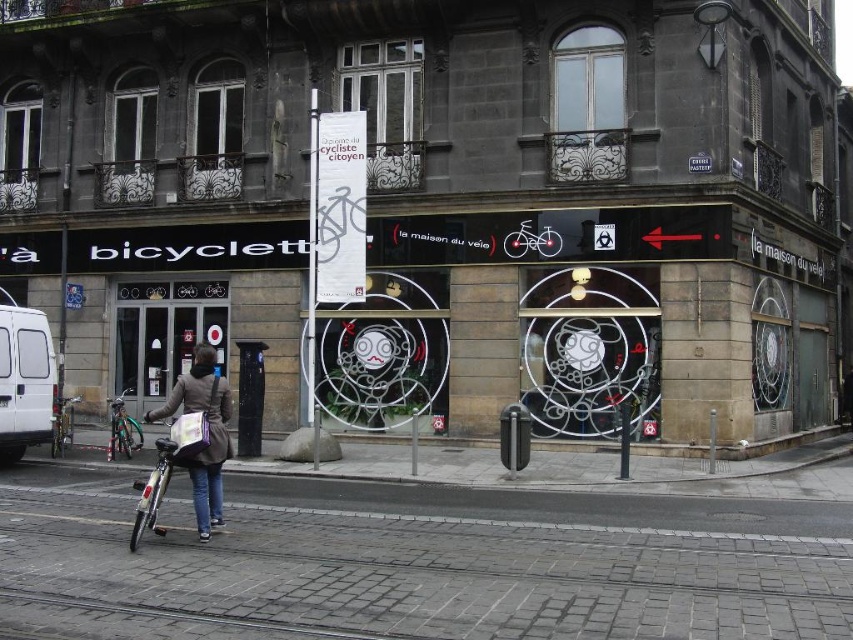
Is matte brown jacket at center bigger than silver metallic bicycle at lower left?

Correct, matte brown jacket at center is larger in size than silver metallic bicycle at lower left.

Is matte brown jacket at center closer to the viewer compared to silver metallic bicycle at lower left?

Yes.

You are a GUI agent. You are given a task and a screenshot of the screen. Output one action in this format:
    pyautogui.click(x=<x>, y=<y>)
    Task: Click on the matte brown jacket at center
    This screenshot has width=853, height=640.
    Given the screenshot: What is the action you would take?
    pyautogui.click(x=209, y=433)

Between white matte van at lower left and silver metallic bicycle at lower left, which one appears on the left side from the viewer's perspective?

white matte van at lower left is more to the left.

The image size is (853, 640). What are the coordinates of `white matte van at lower left` in the screenshot? It's located at (25, 380).

Between white matte van at lower left and shiny silver bicycle at lower left, which one is positioned higher?

white matte van at lower left is above.

Does point (33, 372) come farther from viewer compared to point (164, 488)?

That is True.

Find the location of a particular element. This screenshot has height=640, width=853. white matte van at lower left is located at coordinates (25, 380).

At what (x,y) coordinates should I click in order to perform the action: click on white matte van at lower left. Please return your answer as a coordinate pair (x, y). Looking at the image, I should click on (25, 380).